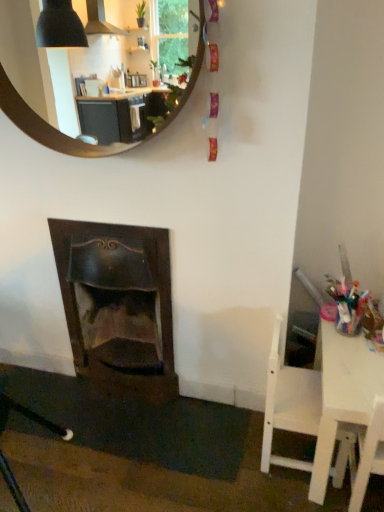
Identify the location of free space to the left of white wood chair at lower right. This screenshot has width=384, height=512. (225, 450).